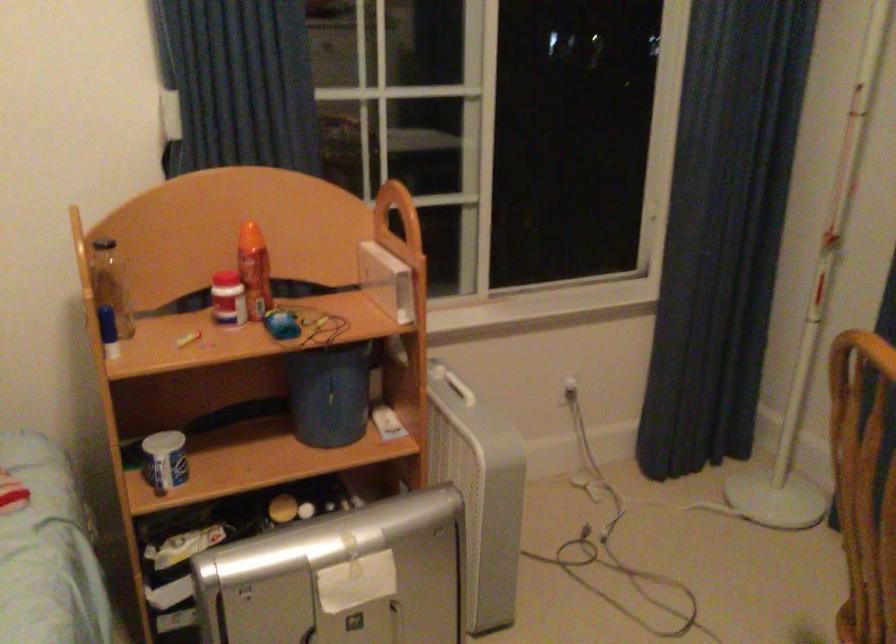
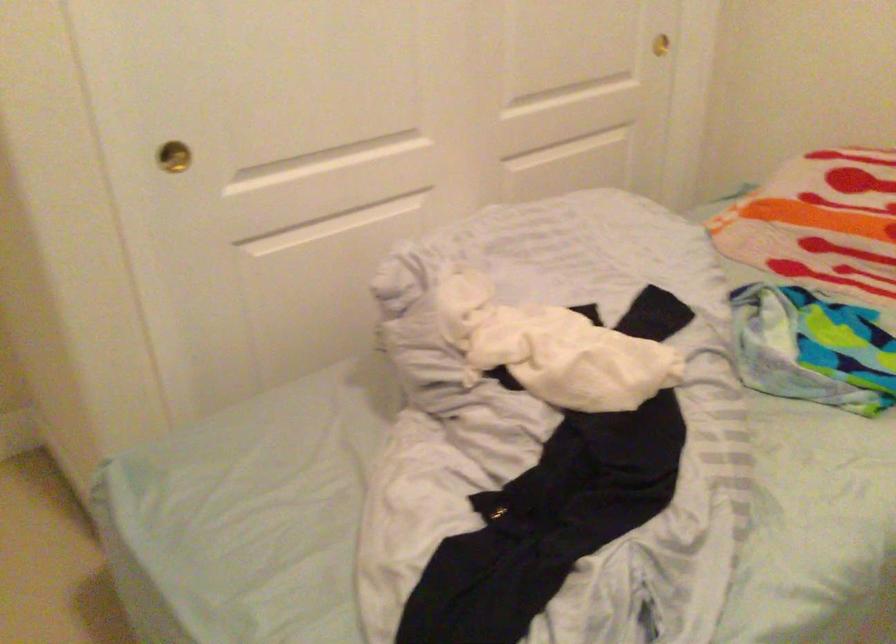
First-person continuous shooting, in which direction is the camera rotating?

The camera's rotation is toward left-down.